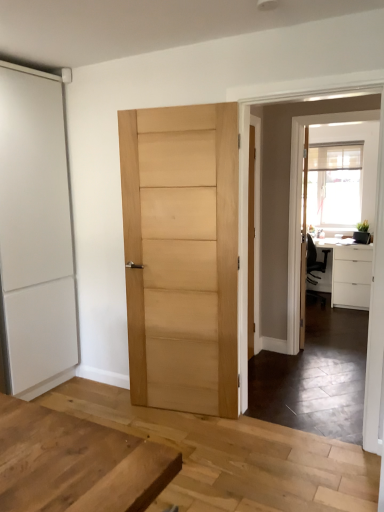
What is the approximate width of white matte cabinet at right?

white matte cabinet at right is 73.83 centimeters wide.

What do you see at coordinates (181, 255) in the screenshot? The image size is (384, 512). I see `natural wood door at center, which is the first door in right-to-left order` at bounding box center [181, 255].

What is the approximate width of clear glass screen door at upper right?

clear glass screen door at upper right is 5.28 centimeters wide.

Identify the location of white matte cabinet at right. (351, 277).

Considering the sizes of objects natural wood door at center, the second door from the left, and white matte sliding door at left, which ranks as the second door in right-to-left order, in the image provided, who is bigger, natural wood door at center, the second door from the left, or white matte sliding door at left, which ranks as the second door in right-to-left order,?

white matte sliding door at left, which ranks as the second door in right-to-left order, is bigger.

Is natural wood door at center, which is the first door in right-to-left order, far from white matte sliding door at left, placed as the first door when sorted from left to right?

No.

Is natural wood door at center, which is the first door in right-to-left order, inside or outside of white matte sliding door at left, which ranks as the second door in right-to-left order?

natural wood door at center, which is the first door in right-to-left order, is outside white matte sliding door at left, which ranks as the second door in right-to-left order.

The width and height of the screenshot is (384, 512). In order to click on door that is on the right side of white matte sliding door at left, which ranks as the second door in right-to-left order in this screenshot , I will do `click(181, 255)`.

Is white matte sliding door at left, which ranks as the second door in right-to-left order, turned away from natural wood door at center, which is the first door in right-to-left order?

white matte sliding door at left, which ranks as the second door in right-to-left order, does not have its back to natural wood door at center, which is the first door in right-to-left order.

Considering the relative sizes of white matte sliding door at left, placed as the first door when sorted from left to right, and natural wood door at center, which is the first door in right-to-left order, in the image provided, is white matte sliding door at left, placed as the first door when sorted from left to right, thinner than natural wood door at center, which is the first door in right-to-left order,?

Incorrect, the width of white matte sliding door at left, placed as the first door when sorted from left to right, is not less than that of natural wood door at center, which is the first door in right-to-left order.

Which of these two, natural wood door at center, the second door from the left, or clear glass screen door at upper right, is smaller?

clear glass screen door at upper right is smaller.

Is natural wood door at center, the second door from the left, wider or thinner than clear glass screen door at upper right?

In the image, natural wood door at center, the second door from the left, appears to be wider than clear glass screen door at upper right.

The height and width of the screenshot is (512, 384). I want to click on screen door above the natural wood door at center, which is the first door in right-to-left order (from a real-world perspective), so [x=362, y=182].

From the image's perspective, which object appears higher, natural wood door at center, which is the first door in right-to-left order, or clear glass screen door at upper right?

clear glass screen door at upper right, from the image's perspective.

Does clear glass screen door at upper right touch white matte cabinet at right?

No, clear glass screen door at upper right is not next to white matte cabinet at right.

This screenshot has width=384, height=512. In order to click on screen door on the left of white matte cabinet at right in this screenshot , I will do `click(362, 182)`.

From a real-world perspective, is clear glass screen door at upper right above or below white matte cabinet at right?

From a real-world perspective, clear glass screen door at upper right is physically above white matte cabinet at right.

Considering the relative sizes of white matte cabinet at right and clear glass screen door at upper right in the image provided, is white matte cabinet at right taller than clear glass screen door at upper right?

No, white matte cabinet at right is not taller than clear glass screen door at upper right.

Which is in front, white matte cabinet at right or clear glass screen door at upper right?

Positioned in front is clear glass screen door at upper right.

Can you confirm if white matte cabinet at right is wider than clear glass screen door at upper right?

Correct, the width of white matte cabinet at right exceeds that of clear glass screen door at upper right.

Is white matte cabinet at right not within clear glass screen door at upper right?

white matte cabinet at right lies outside clear glass screen door at upper right's area.

In the scene shown: In terms of width, does clear glass screen door at upper right look wider or thinner when compared to white matte sliding door at left, placed as the first door when sorted from left to right?

clear glass screen door at upper right is thinner than white matte sliding door at left, placed as the first door when sorted from left to right.

From the image's perspective, is clear glass screen door at upper right under white matte sliding door at left, which ranks as the second door in right-to-left order?

Yes, from the image's perspective, clear glass screen door at upper right is below white matte sliding door at left, which ranks as the second door in right-to-left order.

Is clear glass screen door at upper right oriented towards white matte sliding door at left, placed as the first door when sorted from left to right?

No, clear glass screen door at upper right is not turned towards white matte sliding door at left, placed as the first door when sorted from left to right.

Is clear glass screen door at upper right shorter than white matte sliding door at left, which ranks as the second door in right-to-left order?

Indeed, clear glass screen door at upper right has a lesser height compared to white matte sliding door at left, which ranks as the second door in right-to-left order.

Is white matte sliding door at left, which ranks as the second door in right-to-left order, inside the boundaries of clear glass screen door at upper right, or outside?

white matte sliding door at left, which ranks as the second door in right-to-left order, is spatially situated outside clear glass screen door at upper right.

Where is `door that is the 1st one when counting forward from the clear glass screen door at upper right`? door that is the 1st one when counting forward from the clear glass screen door at upper right is located at coordinates (36, 232).

From a real-world perspective, is white matte sliding door at left, placed as the first door when sorted from left to right, positioned over clear glass screen door at upper right based on gravity?

Yes.

I want to click on door located above the natural wood door at center, which is the first door in right-to-left order (from the image's perspective), so click(x=36, y=232).

The width and height of the screenshot is (384, 512). I want to click on door on the right of white matte sliding door at left, placed as the first door when sorted from left to right, so [x=181, y=255].

Based on their spatial positions, is white matte sliding door at left, placed as the first door when sorted from left to right, or natural wood door at center, which is the first door in right-to-left order, closer to clear glass screen door at upper right?

The object closer to clear glass screen door at upper right is natural wood door at center, which is the first door in right-to-left order.

Which object lies nearer to the anchor point clear glass screen door at upper right, natural wood door at center, which is the first door in right-to-left order, or white matte cabinet at right?

white matte cabinet at right is positioned closer to the anchor clear glass screen door at upper right.

Considering their positions, is clear glass screen door at upper right positioned closer to natural wood door at center, which is the first door in right-to-left order, than white matte sliding door at left, which ranks as the second door in right-to-left order?

white matte sliding door at left, which ranks as the second door in right-to-left order.

Looking at the image, which one is located closer to white matte cabinet at right, white matte sliding door at left, which ranks as the second door in right-to-left order, or natural wood door at center, the second door from the left?

natural wood door at center, the second door from the left, lies closer to white matte cabinet at right than the other object.

Based on their spatial positions, is natural wood door at center, the second door from the left, or white matte sliding door at left, which ranks as the second door in right-to-left order, closer to white matte cabinet at right?

natural wood door at center, the second door from the left, is closer to white matte cabinet at right.

Based on their spatial positions, is white matte sliding door at left, which ranks as the second door in right-to-left order, or white matte cabinet at right closer to natural wood door at center, the second door from the left?

Among the two, white matte sliding door at left, which ranks as the second door in right-to-left order, is located nearer to natural wood door at center, the second door from the left.

When comparing their distances from white matte sliding door at left, placed as the first door when sorted from left to right, does clear glass screen door at upper right or white matte cabinet at right seem closer?

white matte cabinet at right.

Based on their spatial positions, is natural wood door at center, which is the first door in right-to-left order, or white matte cabinet at right closer to white matte sliding door at left, placed as the first door when sorted from left to right?

natural wood door at center, which is the first door in right-to-left order.

Locate an element on the screen. door between white matte sliding door at left, placed as the first door when sorted from left to right, and white matte cabinet at right from left to right is located at coordinates (181, 255).

The image size is (384, 512). Find the location of `screen door between white matte sliding door at left, which ranks as the second door in right-to-left order, and white matte cabinet at right, in the horizontal direction`. screen door between white matte sliding door at left, which ranks as the second door in right-to-left order, and white matte cabinet at right, in the horizontal direction is located at coordinates (362, 182).

The width and height of the screenshot is (384, 512). Identify the location of door between white matte sliding door at left, which ranks as the second door in right-to-left order, and clear glass screen door at upper right, in the horizontal direction. point(181,255).

Find the location of `screen door between natural wood door at center, the second door from the left, and white matte cabinet at right from front to back`. screen door between natural wood door at center, the second door from the left, and white matte cabinet at right from front to back is located at coordinates (362, 182).